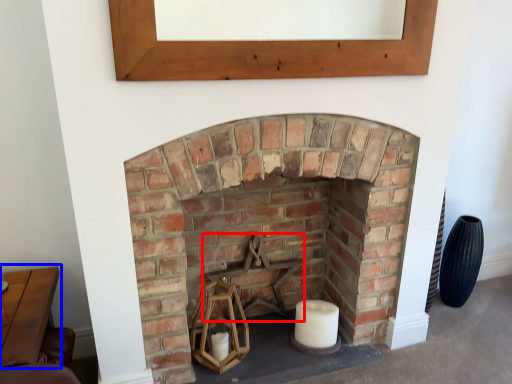
Question: Among these objects, which one is nearest to the camera, armchair (highlighted by a red box) or table (highlighted by a blue box)?

Choices:
 (A) armchair
 (B) table

Answer: (B)